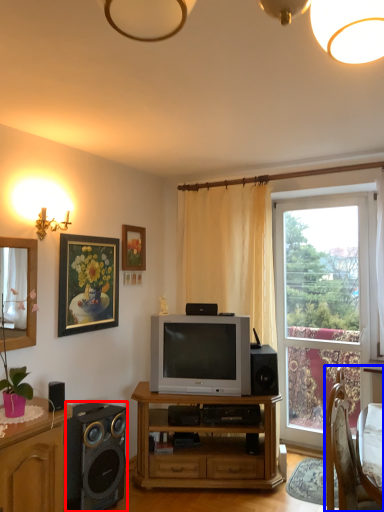
Question: Which of the following is the closest to the observer, speaker (highlighted by a red box) or chair (highlighted by a blue box)?

Choices:
 (A) speaker
 (B) chair

Answer: (B)